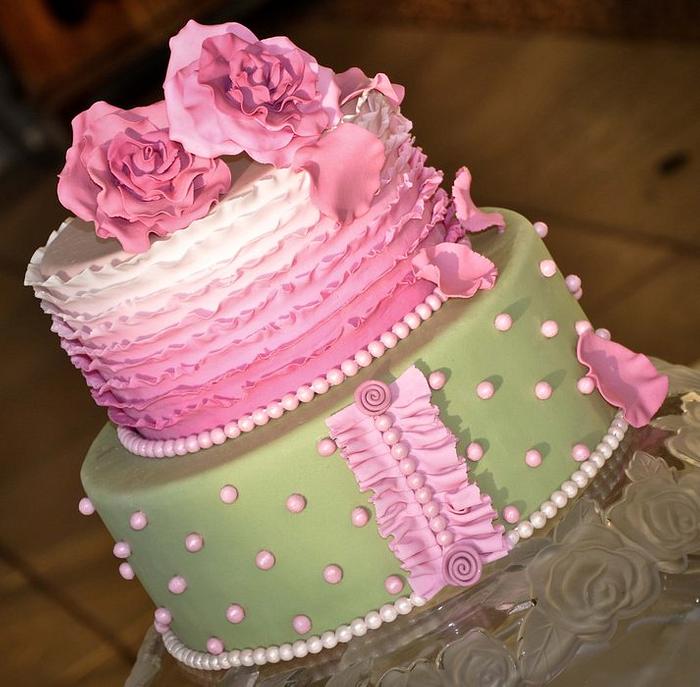
At what (x,y) coordinates should I click in order to perform the action: click on pink pearl decor. Please return your answer as a coordinate pair (x, y). The image size is (700, 687). Looking at the image, I should click on (542, 387).